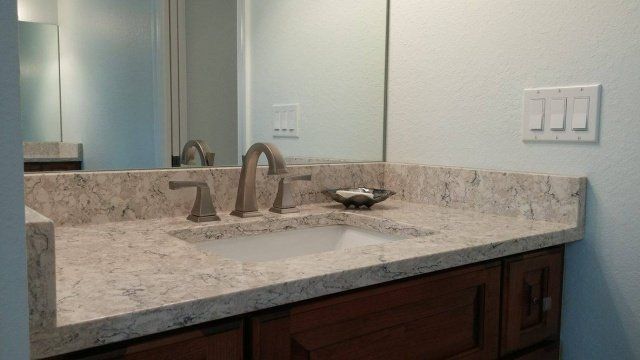
Where is `sink counter top`? This screenshot has width=640, height=360. sink counter top is located at coordinates (116, 268), (484, 231).